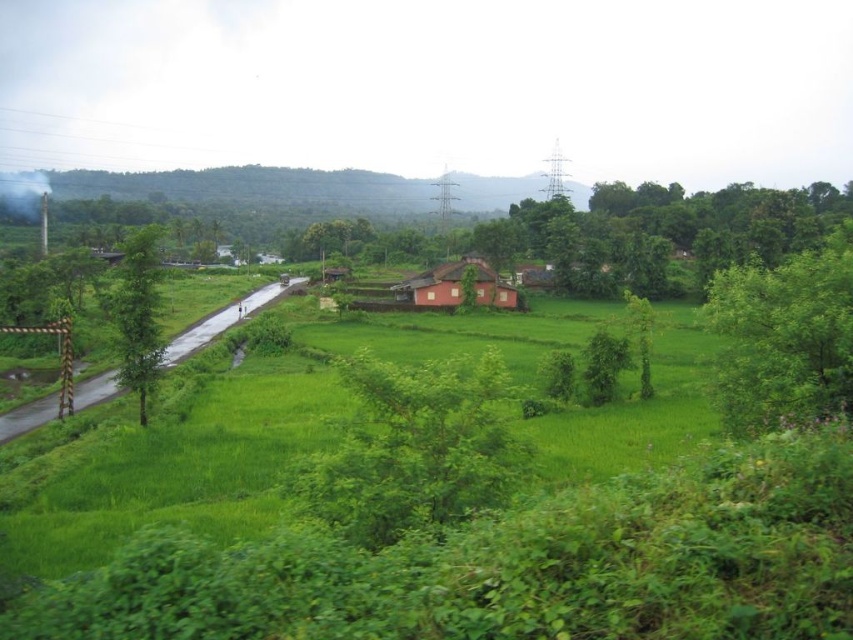
Between green leafy tree at right and matte pink house at center, which one is positioned lower?

Positioned lower is green leafy tree at right.

This screenshot has height=640, width=853. What do you see at coordinates (785, 337) in the screenshot?
I see `green leafy tree at right` at bounding box center [785, 337].

Find the location of a particular element. The width and height of the screenshot is (853, 640). green leafy tree at right is located at coordinates (785, 337).

Which is more to the left, green leafy tree at right or green leafy tree at left?

Positioned to the left is green leafy tree at left.

Measure the distance between green leafy tree at right and green leafy tree at left.

The distance of green leafy tree at right from green leafy tree at left is 40.12 meters.

Is point (827, 390) closer to camera compared to point (154, 371)?

Yes.

This screenshot has width=853, height=640. I want to click on green leafy tree at right, so click(785, 337).

Is green leafy tree at left further to camera compared to matte pink house at center?

No, it is in front of matte pink house at center.

Can you confirm if green leafy tree at left is bigger than matte pink house at center?

Yes, green leafy tree at left is bigger than matte pink house at center.

Does point (148, 314) come farther from viewer compared to point (440, 301)?

No, (148, 314) is closer to viewer.

You are a GUI agent. You are given a task and a screenshot of the screen. Output one action in this format:
    pyautogui.click(x=<x>, y=<y>)
    Task: Click on the green leafy tree at left
    
    Given the screenshot: What is the action you would take?
    (x=138, y=314)